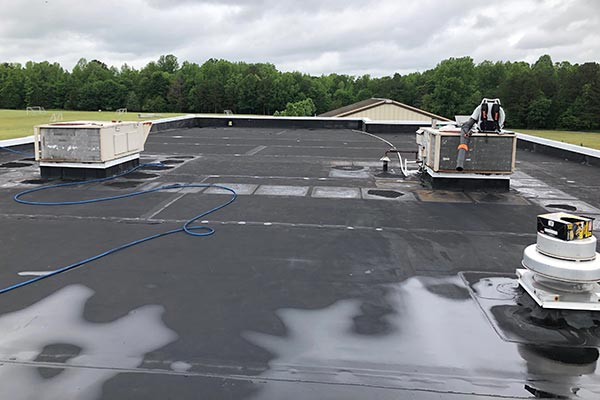
This screenshot has width=600, height=400. Find the location of `white thin pipework`. white thin pipework is located at coordinates (406, 165).